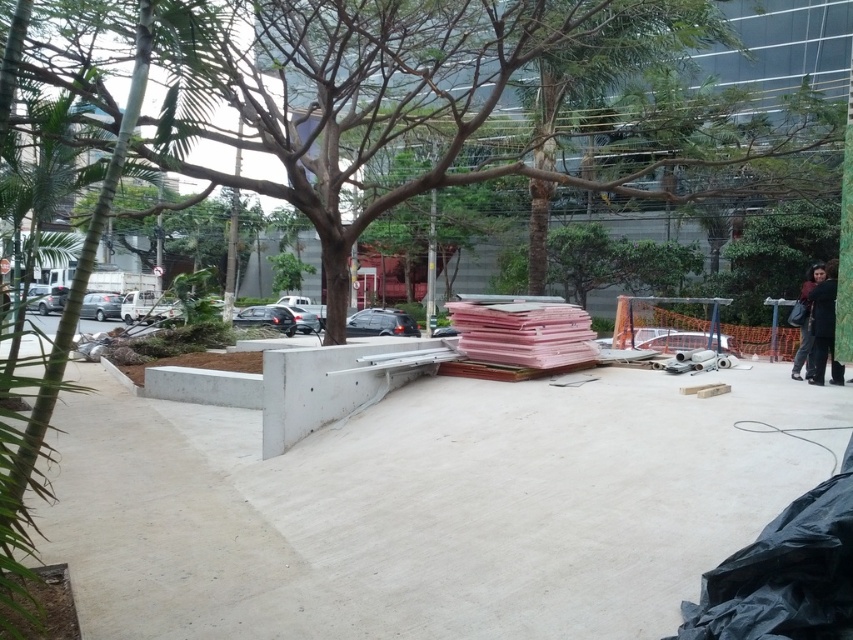
Question: Is the position of black fabric at right more distant than that of dark gray fabric at right?

Choices:
 (A) no
 (B) yes

Answer: (A)

Question: Among these objects, which one is farthest from the camera?

Choices:
 (A) white smooth concrete at center
 (B) black fabric at right
 (C) dark gray fabric at right

Answer: (C)

Question: Is the position of white smooth concrete at center less distant than that of dark gray fabric at right?

Choices:
 (A) no
 (B) yes

Answer: (B)

Question: Among these objects, which one is farthest from the camera?

Choices:
 (A) black fabric at right
 (B) dark gray fabric at right
 (C) white smooth concrete at center

Answer: (B)

Question: Which object is farther from the camera taking this photo?

Choices:
 (A) dark gray fabric at right
 (B) black fabric at right
 (C) white smooth concrete at center

Answer: (A)

Question: Observing the image, what is the correct spatial positioning of black fabric at right in reference to dark gray fabric at right?

Choices:
 (A) above
 (B) below

Answer: (B)